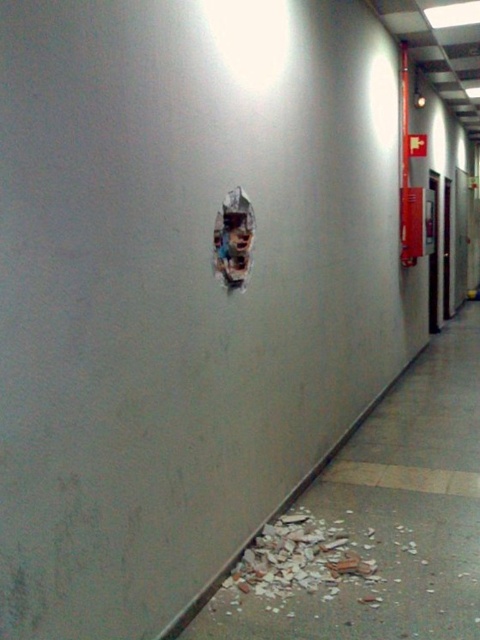
Question: Is crumbly concrete debris at lower center above ripped paper at center?

Choices:
 (A) yes
 (B) no

Answer: (B)

Question: Which of the following is the closest to the observer?

Choices:
 (A) crumbly concrete debris at lower center
 (B) ripped paper at center

Answer: (A)

Question: Is crumbly concrete debris at lower center smaller than ripped paper at center?

Choices:
 (A) no
 (B) yes

Answer: (A)

Question: Which point appears farthest from the camera in this image?

Choices:
 (A) (243, 250)
 (B) (328, 547)

Answer: (B)

Question: Which of the following is the farthest from the observer?

Choices:
 (A) (312, 522)
 (B) (243, 273)

Answer: (A)

Question: Is crumbly concrete debris at lower center thinner than ripped paper at center?

Choices:
 (A) yes
 (B) no

Answer: (B)